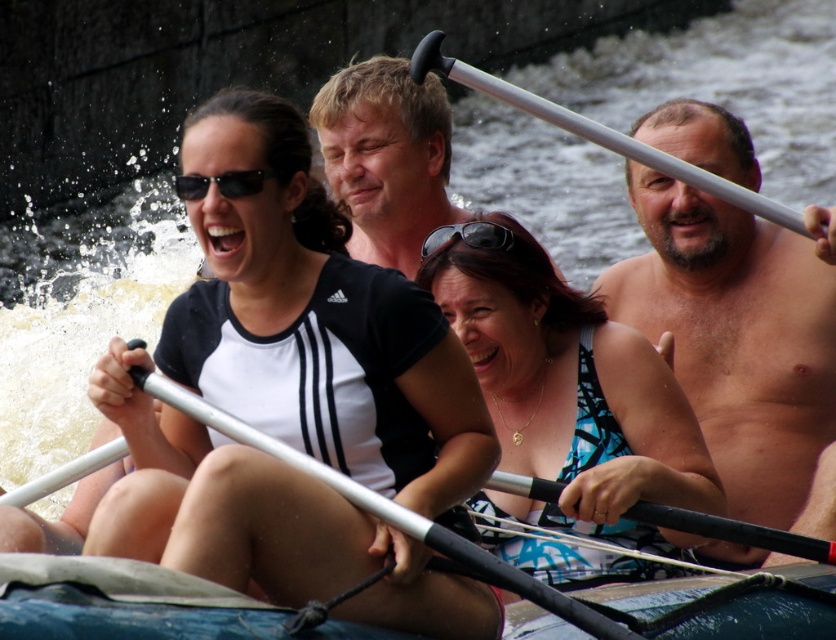
You are a photographer trying to capture a closeup shot of the silver metallic paddle at upper right and the black matte sunglasses at upper left. Which object should you zoom in on more to ensure both are in focus, considering their sizes?

The silver metallic paddle at upper right is larger than the black matte sunglasses at upper left, so you should zoom in more on the sunglasses to ensure both are in focus.

Based on the scene description, which object is located below the other between the blue printed swimsuit at center and the black plastic sunglasses at center?

The blue printed swimsuit at center is positioned under the black plastic sunglasses at center.